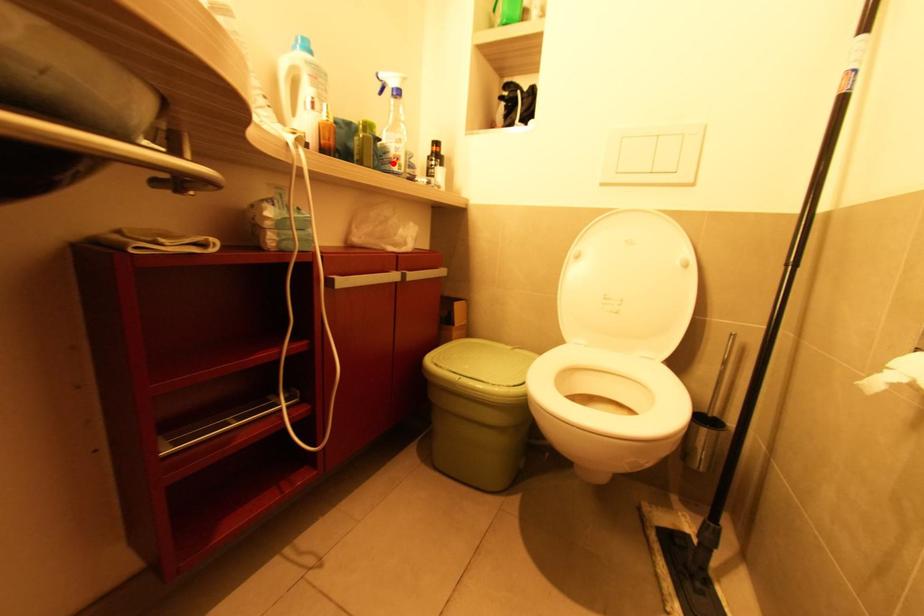
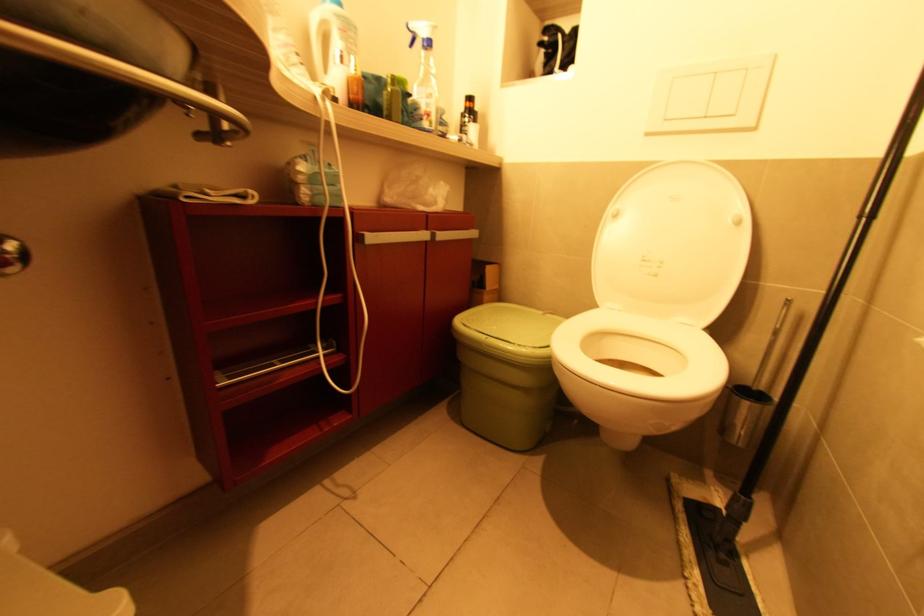
The point at the highlighted location is marked in the first image. Where is the corresponding point in the second image?

(424, 121)